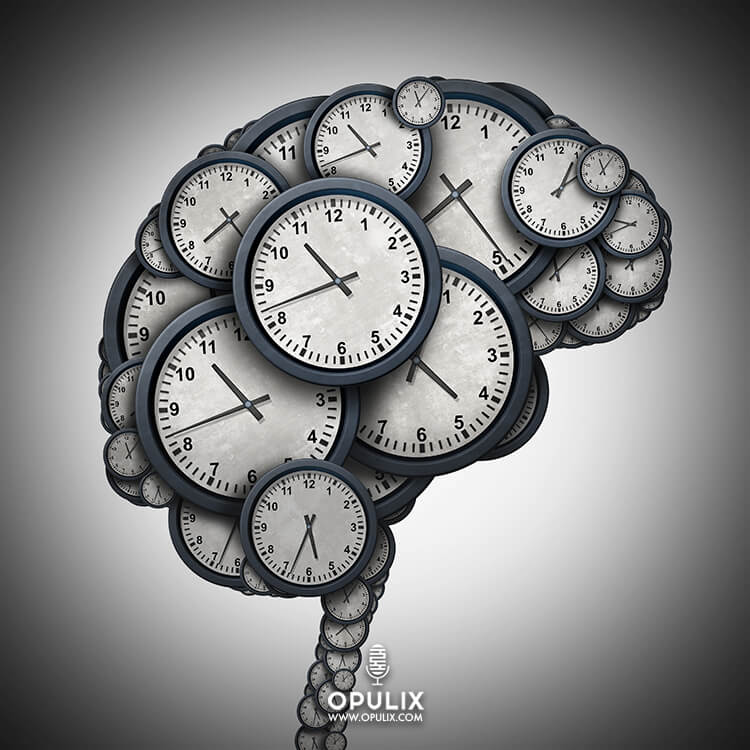
The height and width of the screenshot is (750, 750). I want to click on clock reading 11:08, so click(609, 175), click(424, 112), click(120, 458), click(354, 600), click(345, 682).